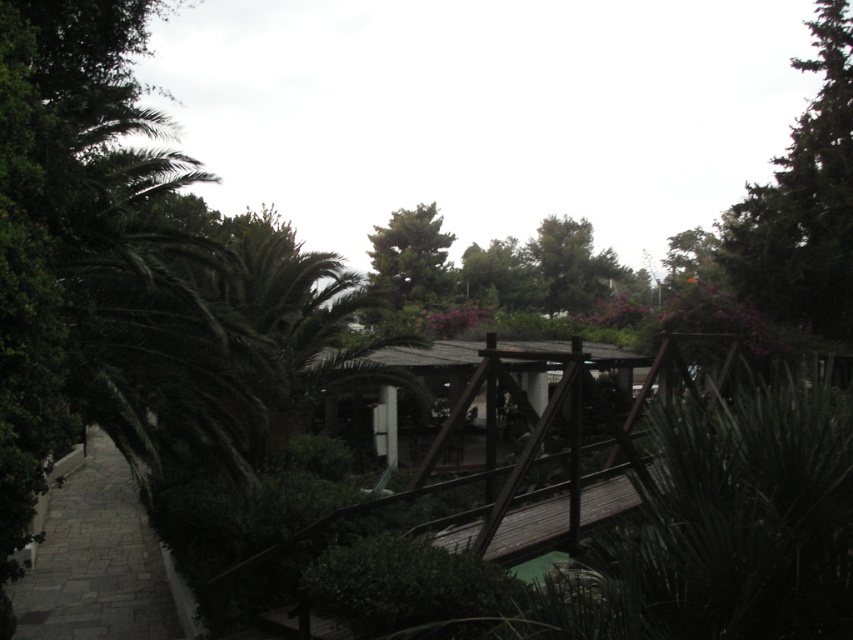
Question: Is gray stone path at lower left below green leafy tree at upper center?

Choices:
 (A) yes
 (B) no

Answer: (A)

Question: Does gray stone path at lower left lie in front of green leafy tree at upper center?

Choices:
 (A) yes
 (B) no

Answer: (A)

Question: Can you confirm if gray stone path at lower left is smaller than green leafy tree at upper center?

Choices:
 (A) no
 (B) yes

Answer: (B)